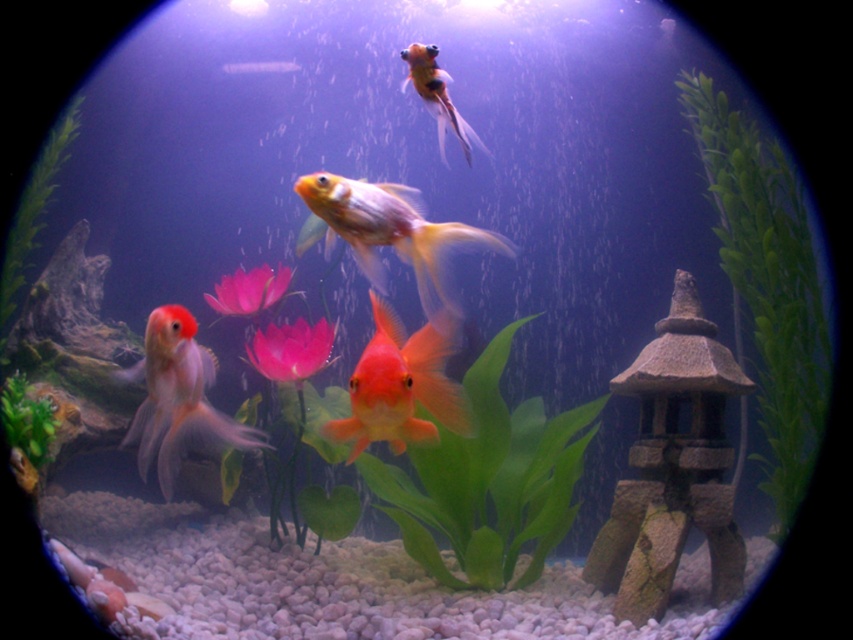
You are a goldfish swimming in the aquarium. You see the green matte plant at lower left and the pink matte lotus at center. Which object is positioned lower in the aquarium?

The green matte plant at lower left is positioned lower than the pink matte lotus at center.

You are observing an aquarium through a circular lens. There are two points marked in the image. The first point is at coordinate point(6, 384) and the second is at point(268, 273). Which point is closer to you, the observer?

Point(6, 384) is closer to the viewer than point(268, 273).

You are an underwater photographer aiming to capture a photo of the pink matte flower at center and the pink matte lotus at center. Based on their positions, which one should you focus on first to ensure both are in the frame?

The pink matte flower at center is located below the pink matte lotus at center, so you should focus on the pink matte lotus at center first to ensure both are in the frame.